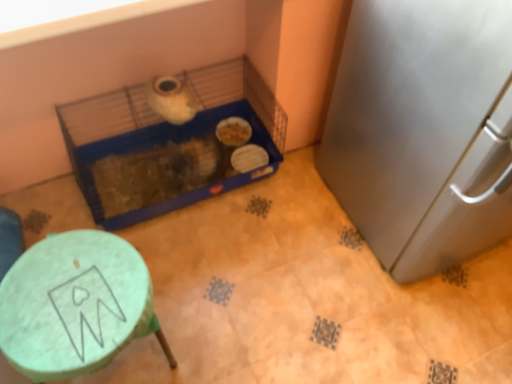
The image size is (512, 384). I want to click on space that is in front of blue plastic bird cage at center, so click(214, 282).